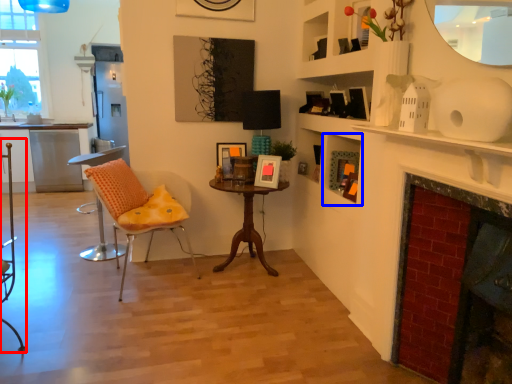
Question: Which of the following is the closest to the observer, armchair (highlighted by a red box) or shelf (highlighted by a blue box)?

Choices:
 (A) armchair
 (B) shelf

Answer: (A)